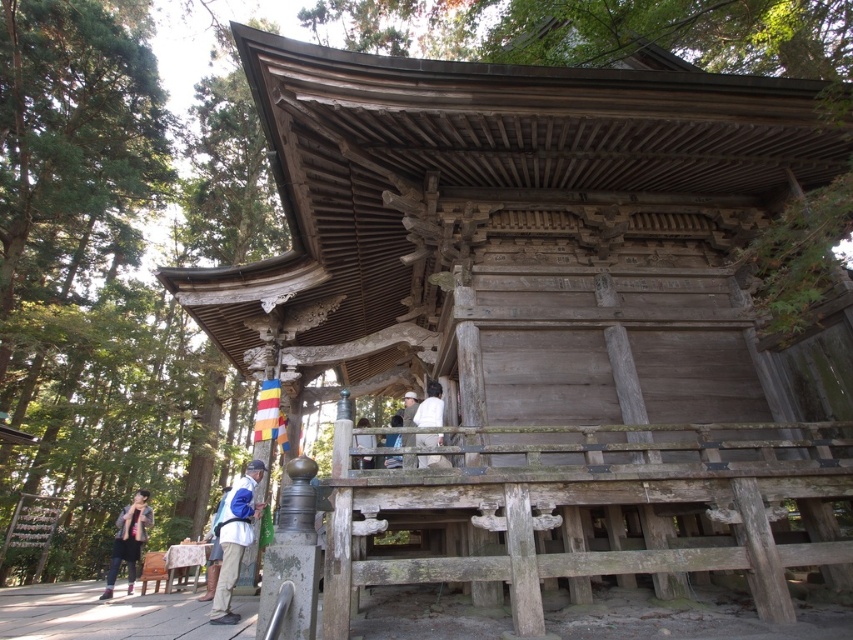
You are standing in front of the traditional wooden pavilion in the forest. You see a white fabric bag at lower center. Can you pick it up without moving closer than 4 meters?

The white fabric bag at lower center is 4.76 meters away from you, so you can reach it without moving closer than 4 meters because the distance is greater than 4 meters.

You are a hiker who has just arrived at the pavilion and notices the denim jacket at lower left and the white fabric at center. Which object is closer to you as you stand at the entrance of the pavilion?

The denim jacket at lower left is closer to you because the white fabric at center is behind it.